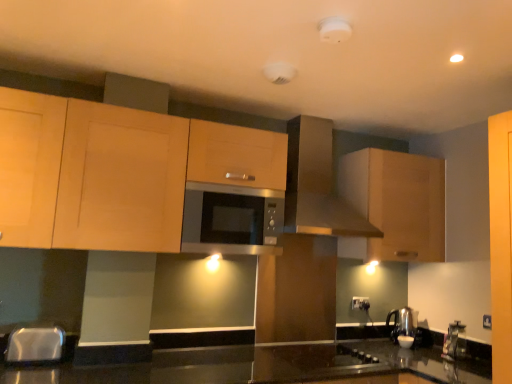
Question: Considering the relative sizes of light wood cabinet at upper center, which is the first cabinetry from left to right, and matte wood cabinet at upper right, placed as the second cabinetry when sorted from left to right, in the image provided, is light wood cabinet at upper center, which is the first cabinetry from left to right, bigger than matte wood cabinet at upper right, placed as the second cabinetry when sorted from left to right,?

Choices:
 (A) yes
 (B) no

Answer: (A)

Question: Is light wood cabinet at upper center, which is the first cabinetry from left to right, at the left side of matte wood cabinet at upper right, placed as the second cabinetry when sorted from left to right?

Choices:
 (A) yes
 (B) no

Answer: (A)

Question: Is light wood cabinet at upper center, the second cabinetry positioned from the right, thinner than matte wood cabinet at upper right, placed as the second cabinetry when sorted from left to right?

Choices:
 (A) no
 (B) yes

Answer: (B)

Question: Is light wood cabinet at upper center, the second cabinetry positioned from the right, outside of matte wood cabinet at upper right, placed as the second cabinetry when sorted from left to right?

Choices:
 (A) yes
 (B) no

Answer: (A)

Question: Is light wood cabinet at upper center, the second cabinetry positioned from the right, far away from matte wood cabinet at upper right, placed as the second cabinetry when sorted from left to right?

Choices:
 (A) yes
 (B) no

Answer: (A)

Question: Is satin silver microwave at center in front of or behind metallic stainless steel sink at lower left in the image?

Choices:
 (A) front
 (B) behind

Answer: (B)

Question: In terms of width, does satin silver microwave at center look wider or thinner when compared to metallic stainless steel sink at lower left?

Choices:
 (A) wide
 (B) thin

Answer: (A)

Question: Does point (252, 215) appear closer or farther from the camera than point (39, 345)?

Choices:
 (A) closer
 (B) farther

Answer: (B)

Question: Looking at the image, does satin silver microwave at center seem bigger or smaller compared to metallic stainless steel sink at lower left?

Choices:
 (A) big
 (B) small

Answer: (A)

Question: Is point (48, 336) positioned closer to the camera than point (217, 167)?

Choices:
 (A) farther
 (B) closer

Answer: (B)

Question: From their relative heights in the image, would you say metallic stainless steel sink at lower left is taller or shorter than light wood cabinet at upper center, the second cabinetry positioned from the right?

Choices:
 (A) tall
 (B) short

Answer: (B)

Question: From the image's perspective, is metallic stainless steel sink at lower left located above or below light wood cabinet at upper center, which is the first cabinetry from left to right?

Choices:
 (A) below
 (B) above

Answer: (A)

Question: Based on their sizes in the image, would you say metallic stainless steel sink at lower left is bigger or smaller than light wood cabinet at upper center, which is the first cabinetry from left to right?

Choices:
 (A) big
 (B) small

Answer: (B)

Question: Considering the positions of light wood cabinet at upper center, which is the first cabinetry from left to right, and matte brown range hood at upper center in the image, is light wood cabinet at upper center, which is the first cabinetry from left to right, bigger or smaller than matte brown range hood at upper center?

Choices:
 (A) big
 (B) small

Answer: (A)

Question: In terms of height, does light wood cabinet at upper center, the second cabinetry positioned from the right, look taller or shorter compared to matte brown range hood at upper center?

Choices:
 (A) tall
 (B) short

Answer: (B)